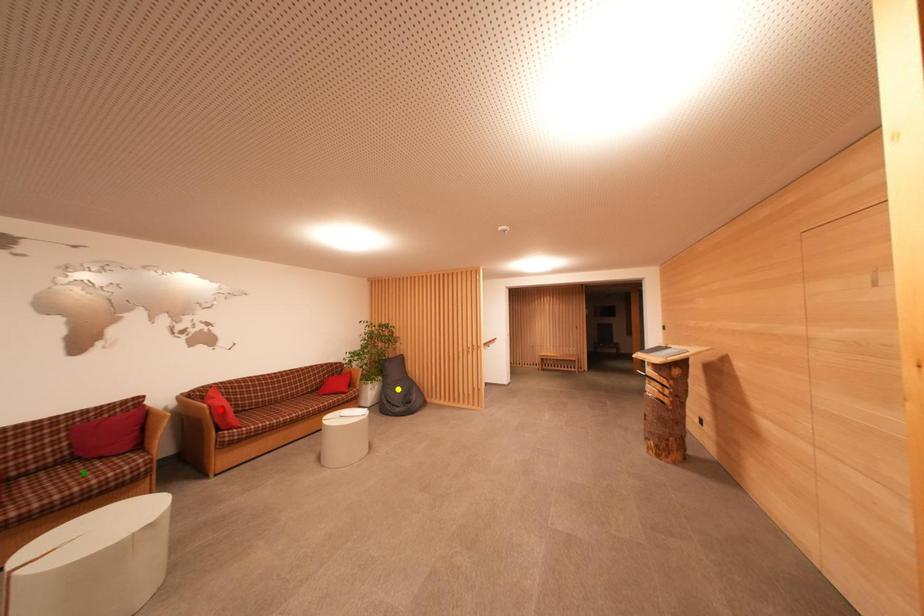
Order these from nearest to farthest:
green point
yellow point
red point

1. green point
2. red point
3. yellow point